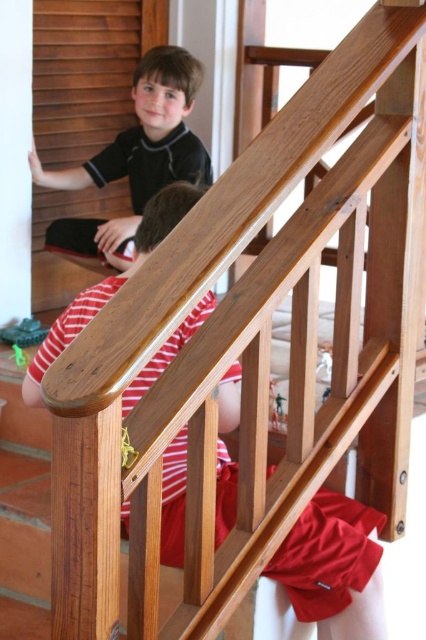
Question: Can you confirm if striped cotton shirt at center is positioned above matte black shirt at upper left?

Choices:
 (A) no
 (B) yes

Answer: (A)

Question: Among these points, which one is nearest to the camera?

Choices:
 (A) (226, 536)
 (B) (69, 244)

Answer: (A)

Question: Can you confirm if striped cotton shirt at center is positioned to the right of matte black shirt at upper left?

Choices:
 (A) no
 (B) yes

Answer: (B)

Question: Is striped cotton shirt at center above matte black shirt at upper left?

Choices:
 (A) no
 (B) yes

Answer: (A)

Question: Which of the following is the closest to the observer?

Choices:
 (A) (164, 227)
 (B) (166, 60)

Answer: (A)